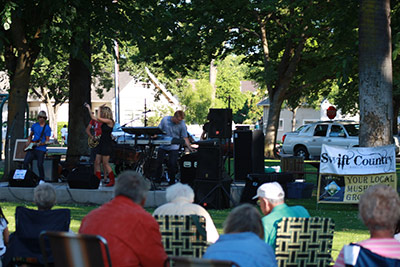
Find the location of `right door`. right door is located at coordinates (334, 140), (315, 144).